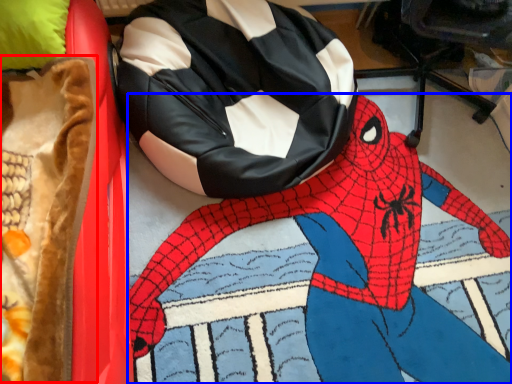
Question: Which object is further to the camera taking this photo, blanket (highlighted by a red box) or person (highlighted by a blue box)?

Choices:
 (A) blanket
 (B) person

Answer: (B)